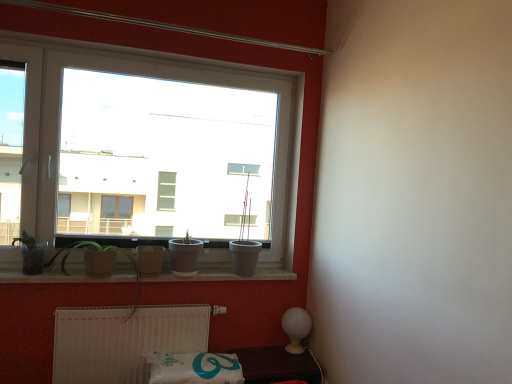
This screenshot has height=384, width=512. Describe the element at coordinates (31, 253) in the screenshot. I see `matte glass pot at left, which appears as the second plant when viewed from the right` at that location.

This screenshot has width=512, height=384. In order to click on matte glass pot at left, which appears as the second plant when viewed from the right in this screenshot , I will do `click(31, 253)`.

The width and height of the screenshot is (512, 384). Describe the element at coordinates (185, 255) in the screenshot. I see `matte gray pot at center` at that location.

Locate an element on the screen. white concrete window sill at lower center is located at coordinates (63, 274).

The width and height of the screenshot is (512, 384). Describe the element at coordinates (277, 365) in the screenshot. I see `white glossy lamp at lower right` at that location.

The image size is (512, 384). What are the coordinates of `matte glass pot at left, which appears as the second plant when viewed from the right` in the screenshot? It's located at (31, 253).

Is white plastic window at upper left in contact with matte gray pot at center?

white plastic window at upper left and matte gray pot at center are not in contact.

Is white plastic window at upper left bigger or smaller than matte gray pot at center?

white plastic window at upper left is bigger than matte gray pot at center.

Is white plastic window at upper left not within matte gray pot at center?

white plastic window at upper left is positioned outside matte gray pot at center.

Which is closer, [26,251] or [198,336]?

The point [26,251] is closer.

From a real-world perspective, is matte glass pot at left, which appears as the second plant when viewed from the right, positioned under white plastic radiator at lower center based on gravity?

Actually, matte glass pot at left, which appears as the second plant when viewed from the right, is physically above white plastic radiator at lower center in the real world.

Does matte glass pot at left, the first plant positioned from the left, appear on the left side of white plastic radiator at lower center?

Correct, you'll find matte glass pot at left, the first plant positioned from the left, to the left of white plastic radiator at lower center.

You are a GUI agent. You are given a task and a screenshot of the screen. Output one action in this format:
    pyautogui.click(x=<x>, y=<y>)
    Task: Click on the radiator located on the right of matte glass pot at left, the first plant positioned from the left
    
    Given the screenshot: What is the action you would take?
    pyautogui.click(x=124, y=340)

Considering the sizes of white plastic radiator at lower center and matte gray pot at center in the image, is white plastic radiator at lower center wider or thinner than matte gray pot at center?

Clearly, white plastic radiator at lower center has less width compared to matte gray pot at center.

From the image's perspective, relative to matte gray pot at center, is white plastic radiator at lower center above or below?

white plastic radiator at lower center is situated lower than matte gray pot at center in the image.

Based on the photo, from a real-world perspective, who is located lower, white plastic radiator at lower center or matte gray pot at center?

In real-world perspective, white plastic radiator at lower center is lower.

Is white plastic radiator at lower center at the back of white glossy lamp at lower right?

No, white glossy lamp at lower right is not facing the opposite direction of white plastic radiator at lower center.

Is white glossy lamp at lower right wider or thinner than white plastic radiator at lower center?

Considering their sizes, white glossy lamp at lower right looks broader than white plastic radiator at lower center.

From a real-world perspective, is white glossy lamp at lower right located higher than white plastic radiator at lower center?

No, from a real-world perspective, white glossy lamp at lower right is not over white plastic radiator at lower center

Which object is positioned more to the left, white glossy lamp at lower right or white plastic radiator at lower center?

From the viewer's perspective, white plastic radiator at lower center appears more on the left side.

Do you think white plastic radiator at lower center is within matte glass pot at left, which appears as the second plant when viewed from the right, or outside of it?

white plastic radiator at lower center exists outside the volume of matte glass pot at left, which appears as the second plant when viewed from the right.

Is white plastic radiator at lower center wider or thinner than matte glass pot at left, which appears as the second plant when viewed from the right?

white plastic radiator at lower center is thinner than matte glass pot at left, which appears as the second plant when viewed from the right.

Can you confirm if white plastic radiator at lower center is bigger than matte glass pot at left, the first plant positioned from the left?

Indeed, white plastic radiator at lower center has a larger size compared to matte glass pot at left, the first plant positioned from the left.

From a real-world perspective, which object rests below the other?

matte gray pot at center, from a real-world perspective.

Where is `houseplant that appears on the right of white plastic window at upper left`? The height and width of the screenshot is (384, 512). houseplant that appears on the right of white plastic window at upper left is located at coordinates (185, 255).

From the image's perspective, which object appears higher, matte gray pot at center or white plastic window at upper left?

From the image's view, white plastic window at upper left is above.

Measure the distance from matte gray pot at center to white concrete window sill at lower center.

8.40 inches.

Is matte gray pot at center positioned beyond the bounds of white concrete window sill at lower center?

Yes, matte gray pot at center is located beyond the bounds of white concrete window sill at lower center.

Considering the relative positions of matte gray pot at center and white concrete window sill at lower center in the image provided, is matte gray pot at center to the left or to the right of white concrete window sill at lower center?

Based on their positions, matte gray pot at center is located to the right of white concrete window sill at lower center.

Does matte gray pot at center have a lesser height compared to white concrete window sill at lower center?

No, matte gray pot at center is not shorter than white concrete window sill at lower center.

The height and width of the screenshot is (384, 512). I want to click on window on the left side of matte gray pot at center, so click(152, 150).

From the image's perspective, starting from the white plastic radiator at lower center, which plant is the 2nd one above? Please provide its 2D coordinates.

[(31, 253)]

From the image, which object appears to be nearer to white plastic radiator at lower center, white plastic window at upper left or matte gray pot at center?

matte gray pot at center is positioned closer to the anchor white plastic radiator at lower center.

From the image, which object appears to be farther from white concrete window sill at lower center, green matte plant at lower left, the 1th plant positioned from the right, or white plastic window at upper left?

The object further to white concrete window sill at lower center is white plastic window at upper left.

Looking at the image, which one is located further to green matte plant at lower left, the 1th plant positioned from the right, white plastic window at upper left or matte glass pot at left, which appears as the second plant when viewed from the right?

Based on the image, white plastic window at upper left appears to be further to green matte plant at lower left, the 1th plant positioned from the right.

When comparing their distances from matte glass pot at left, the first plant positioned from the left, does white glossy lamp at lower right or white concrete window sill at lower center seem further?

Based on the image, white glossy lamp at lower right appears to be further to matte glass pot at left, the first plant positioned from the left.

From the image, which object appears to be farther from matte gray pot at center, white plastic radiator at lower center or green matte plant at lower left, the 1th plant positioned from the right?

white plastic radiator at lower center lies further to matte gray pot at center than the other object.

Consider the image. Based on their spatial positions, is matte glass pot at left, the first plant positioned from the left, or matte gray pot at center closer to white concrete window sill at lower center?

matte gray pot at center is closer to white concrete window sill at lower center.

When comparing their distances from white plastic radiator at lower center, does white concrete window sill at lower center or matte gray pot at center seem further?

matte gray pot at center is positioned further to the anchor white plastic radiator at lower center.

Considering their positions, is matte glass pot at left, which appears as the second plant when viewed from the right, positioned closer to green matte plant at lower left, acting as the 2th plant starting from the left, than white plastic radiator at lower center?

The object closer to green matte plant at lower left, acting as the 2th plant starting from the left, is matte glass pot at left, which appears as the second plant when viewed from the right.

This screenshot has height=384, width=512. In order to click on window sill between matte gray pot at center and white plastic radiator at lower center from top to bottom in this screenshot , I will do `click(63, 274)`.

Identify the location of window between matte glass pot at left, which appears as the second plant when viewed from the right, and white glossy lamp at lower right, in the horizontal direction. (152, 150).

Locate an element on the screen. window sill between matte glass pot at left, the first plant positioned from the left, and matte gray pot at center from left to right is located at coordinates (63, 274).

At what (x,y) coordinates should I click in order to perform the action: click on plant between white plastic window at upper left and green matte plant at lower left, the 1th plant positioned from the right, in the vertical direction. Please return your answer as a coordinate pair (x, y). This screenshot has width=512, height=384. Looking at the image, I should click on (31, 253).